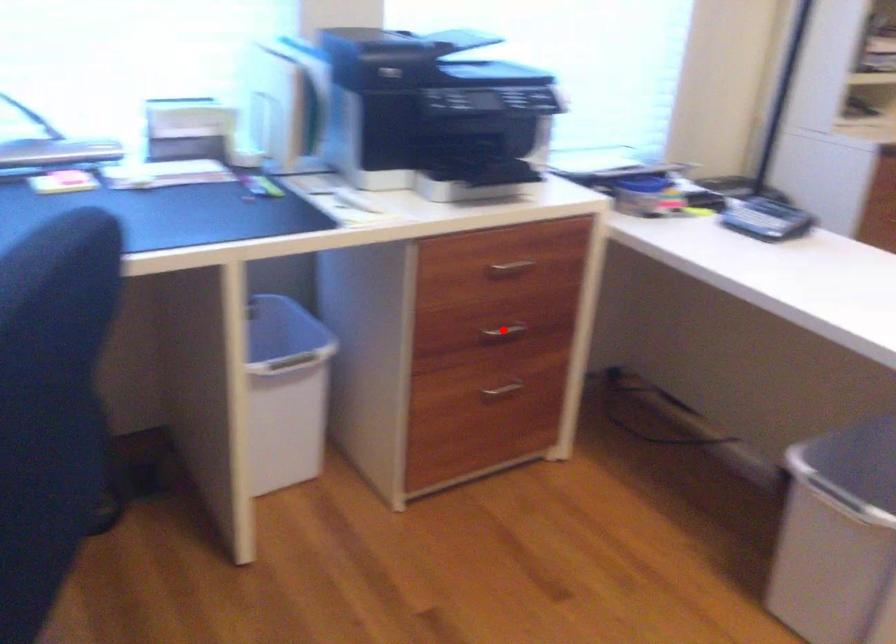
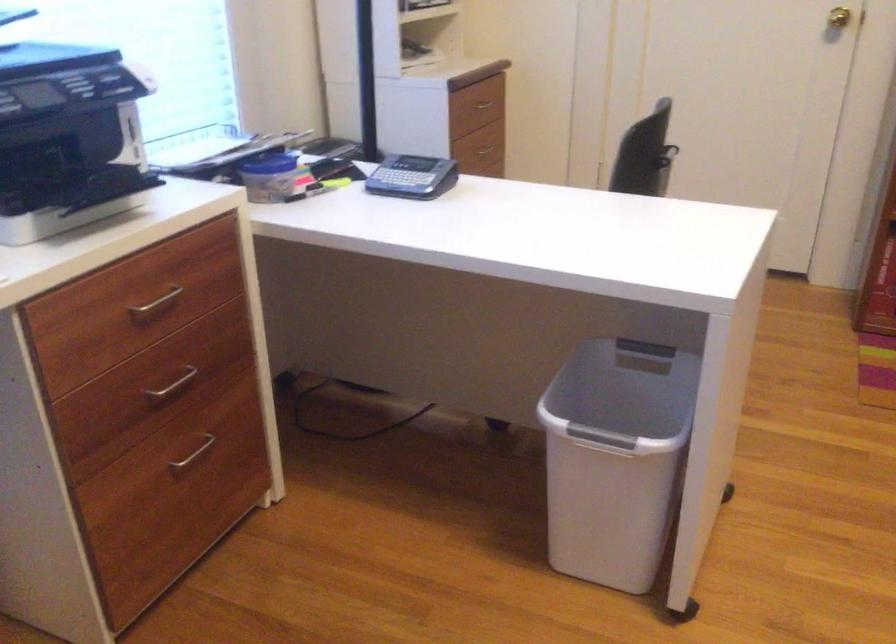
Where in the second image is the point corresponding to the highlighted location from the first image?

(173, 384)